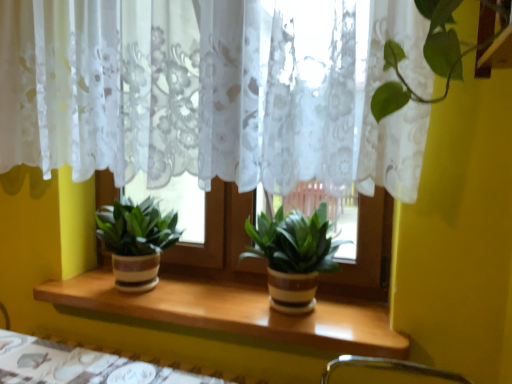
At what (x,y) coordinates should I click in order to perform the action: click on vacant area situated below green matte plant at center, which is the 2th houseplant in left-to-right order (from a real-world perspective). Please return your answer as a coordinate pair (x, y). This screenshot has width=512, height=384. Looking at the image, I should click on (282, 316).